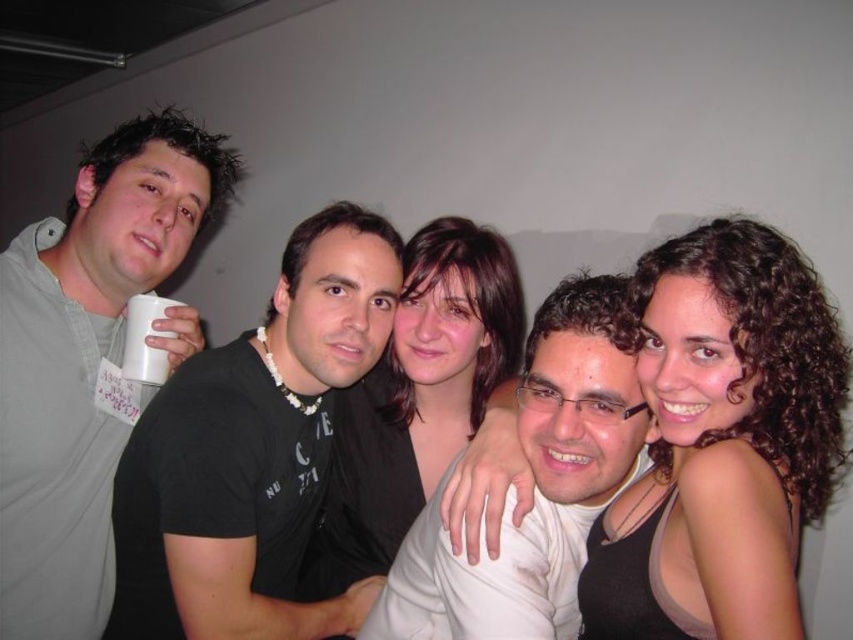
Question: In this image, where is black matte t-shirt at center located relative to white matte cup at upper left?

Choices:
 (A) below
 (B) above

Answer: (A)

Question: Which of these objects is positioned farthest from the matte gray shirt at left?

Choices:
 (A) curly brown hair at center
 (B) black matte t-shirt at center
 (C) white matte shirt at center
 (D) smooth brown hair at center

Answer: (A)

Question: Which of the following is the farthest from the observer?

Choices:
 (A) (572, 577)
 (B) (339, 273)

Answer: (B)

Question: Is the position of curly brown hair at center more distant than that of white matte shirt at center?

Choices:
 (A) no
 (B) yes

Answer: (A)

Question: Does curly brown hair at center appear under white matte cup at upper left?

Choices:
 (A) no
 (B) yes

Answer: (B)

Question: Which is farther from the black matte t-shirt at center?

Choices:
 (A) white matte shirt at center
 (B) white matte cup at upper left

Answer: (A)